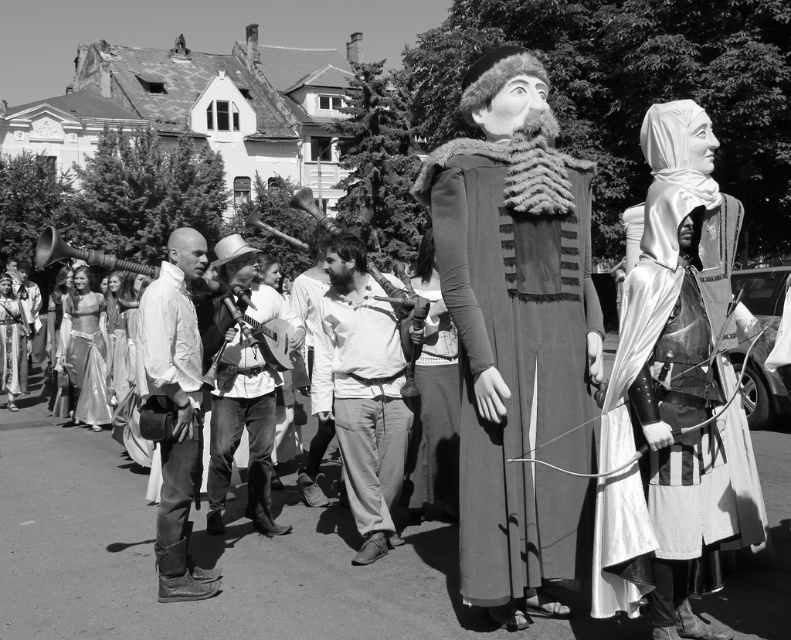
Does light gray cotton pants at center appear on the left side of smooth fabric robe at center?

Indeed, light gray cotton pants at center is positioned on the left side of smooth fabric robe at center.

Can you confirm if light gray cotton pants at center is shorter than smooth fabric robe at center?

No.

Is point (390, 544) positioned before point (419, 500)?

Yes, point (390, 544) is in front of point (419, 500).

You are a GUI agent. You are given a task and a screenshot of the screen. Output one action in this format:
    pyautogui.click(x=<x>, y=<y>)
    Task: Click on the light gray cotton pants at center
    The image size is (791, 640).
    Given the screenshot: What is the action you would take?
    pos(362,392)

Does leather jacket at center have a lesser width compared to silky white dress at lower left?

Yes.

Which of these two, leather jacket at center or silky white dress at lower left, stands shorter?

With less height is silky white dress at lower left.

Locate an element on the screen. leather jacket at center is located at coordinates (241, 429).

Identify the location of leather jacket at center. The height and width of the screenshot is (640, 791). (241, 429).

Between light gray cotton pants at center and shiny silver dress at lower left, which one is positioned lower?

light gray cotton pants at center is lower down.

Does light gray cotton pants at center come behind shiny silver dress at lower left?

No.

Locate an element on the screen. Image resolution: width=791 pixels, height=640 pixels. light gray cotton pants at center is located at coordinates (362, 392).